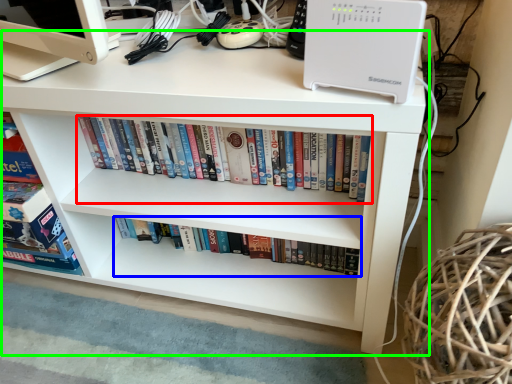
Question: Considering the real-world distances, which object is farthest from book (highlighted by a red box)? book (highlighted by a blue box) or desk (highlighted by a green box)?

Choices:
 (A) book
 (B) desk

Answer: (A)